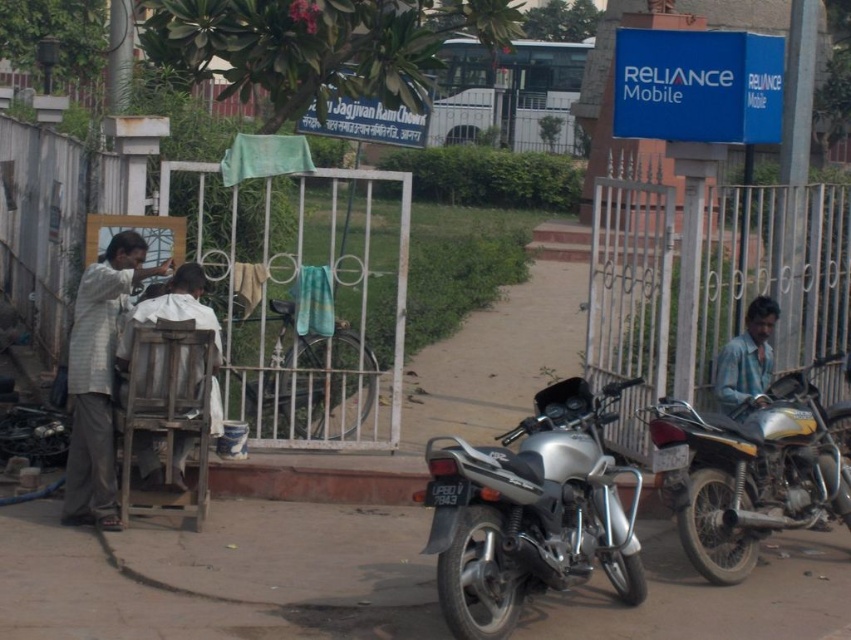
In the scene shown: Between silver metallic motorcycle at right and light gray striped shirt at left, which one appears on the right side from the viewer's perspective?

From the viewer's perspective, silver metallic motorcycle at right appears more on the right side.

Does silver metallic motorcycle at right appear on the left side of light gray striped shirt at left?

In fact, silver metallic motorcycle at right is to the right of light gray striped shirt at left.

Is point (717, 465) in front of point (69, 397)?

Yes, it is in front of point (69, 397).

Find the location of a particular element. silver metallic motorcycle at right is located at coordinates (752, 474).

Who is lower down, light gray striped shirt at left or short brown hair at center?

light gray striped shirt at left is below.

Between light gray striped shirt at left and short brown hair at center, which one has less height?

short brown hair at center is shorter.

Is point (78, 358) farther from viewer compared to point (169, 280)?

No, it is in front of (169, 280).

Locate an element on the screen. The width and height of the screenshot is (851, 640). light gray striped shirt at left is located at coordinates (96, 387).

Who is positioned more to the right, short brown hair at center or brown matte hair at upper left?

short brown hair at center is more to the right.

Is point (203, 280) behind point (130, 241)?

Yes, it is behind point (130, 241).

Locate an element on the screen. short brown hair at center is located at coordinates (187, 280).